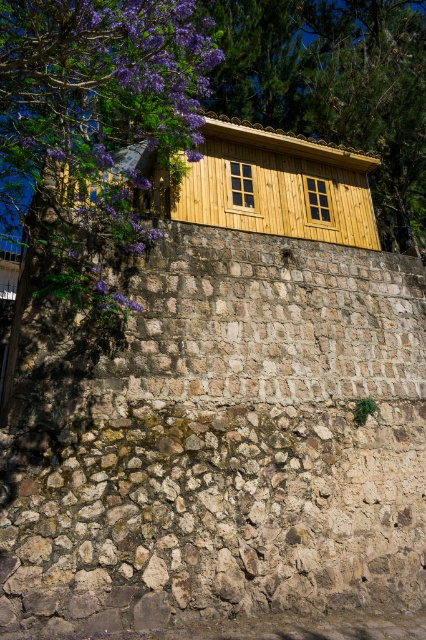
Question: Does brown stone wall at upper center have a larger size compared to wooden window at center?

Choices:
 (A) yes
 (B) no

Answer: (B)

Question: Which object is positioned closest to the wooden window at center?

Choices:
 (A) brown stone wall at upper center
 (B) wooden window at upper center

Answer: (B)

Question: From the image, what is the correct spatial relationship of brown stone wall at upper center in relation to wooden window at center?

Choices:
 (A) right
 (B) left

Answer: (B)

Question: Which of the following is the closest to the observer?

Choices:
 (A) (233, 188)
 (B) (8, 506)

Answer: (B)

Question: Is brown stone wall at upper center above wooden window at center?

Choices:
 (A) no
 (B) yes

Answer: (A)

Question: Which of the following is the farthest from the observer?

Choices:
 (A) wooden window at upper center
 (B) brown stone wall at upper center

Answer: (A)